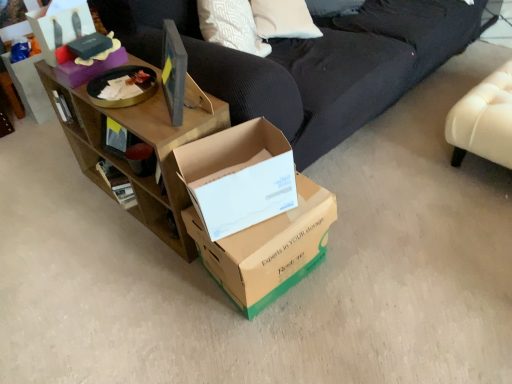
Image resolution: width=512 pixels, height=384 pixels. Describe the element at coordinates (484, 120) in the screenshot. I see `leather ottoman at right` at that location.

What do you see at coordinates (145, 141) in the screenshot? Image resolution: width=512 pixels, height=384 pixels. I see `brown wood shelf at upper left` at bounding box center [145, 141].

What do you see at coordinates (238, 176) in the screenshot? I see `cardboard box at center, the 2th box in the top-to-bottom sequence` at bounding box center [238, 176].

Locate an element on the screen. brown cardboard box at center, positioned as the third box in left-to-right order is located at coordinates pyautogui.click(x=268, y=249).

Does matte black box at upper left, placed as the 1th box when sorted from top to bottom, have a lesser width compared to brown cardboard box at center, the 3th box from the top?

Yes.

Between matte black box at upper left, placed as the 1th box when sorted from top to bottom, and brown cardboard box at center, arranged as the 1th box when viewed from the right, which one has smaller size?

Smaller between the two is matte black box at upper left, placed as the 1th box when sorted from top to bottom.

This screenshot has height=384, width=512. Find the location of `the 2nd box directly above the brown cardboard box at center, arranged as the 1th box when viewed from the right (from a real-world perspective)`. the 2nd box directly above the brown cardboard box at center, arranged as the 1th box when viewed from the right (from a real-world perspective) is located at coordinates (88, 69).

From the image's perspective, is leather ottoman at right located above or below cardboard box at center, the 2th box in the top-to-bottom sequence?

From the image's perspective, leather ottoman at right appears above cardboard box at center, the 2th box in the top-to-bottom sequence.

Which object is further away from the camera, leather ottoman at right or cardboard box at center, which is counted as the 2th box, starting from the left?

leather ottoman at right is further away from the camera.

Locate an element on the screen. furniture located underneath the cardboard box at center, the 2th box in the top-to-bottom sequence (from a real-world perspective) is located at coordinates (x=484, y=120).

Considering the sizes of objects leather ottoman at right and cardboard box at center, the second box in the bottom-to-top sequence, in the image provided, who is shorter, leather ottoman at right or cardboard box at center, the second box in the bottom-to-top sequence,?

cardboard box at center, the second box in the bottom-to-top sequence.

Relative to cardboard box at center, which is counted as the 2th box, starting from the left, is brown cardboard box at center, the 3th box from the top, in front or behind?

Clearly, brown cardboard box at center, the 3th box from the top, is behind cardboard box at center, which is counted as the 2th box, starting from the left.

Who is taller, brown cardboard box at center, arranged as the 1th box when viewed from the right, or cardboard box at center, the 2th box in the top-to-bottom sequence?

Standing taller between the two is brown cardboard box at center, arranged as the 1th box when viewed from the right.

Is brown cardboard box at center, which appears as the 1th box when ordered from the bottom, facing towards cardboard box at center, which is counted as the 2th box, starting from the left?

No, brown cardboard box at center, which appears as the 1th box when ordered from the bottom, does not turn towards cardboard box at center, which is counted as the 2th box, starting from the left.

From the picture: From the image's perspective, does brown cardboard box at center, positioned as the third box in left-to-right order, appear lower than cardboard box at center, which is counted as the 2th box, starting from the left?

Yes, from the image's perspective, brown cardboard box at center, positioned as the third box in left-to-right order, is below cardboard box at center, which is counted as the 2th box, starting from the left.

From the image's perspective, is cardboard box at center, which ranks as the 2th box in right-to-left order, located above or below brown wood shelf at upper left?

cardboard box at center, which ranks as the 2th box in right-to-left order, is situated lower than brown wood shelf at upper left in the image.

Is cardboard box at center, which ranks as the 2th box in right-to-left order, at the right side of brown wood shelf at upper left?

Yes.

Is cardboard box at center, the second box in the bottom-to-top sequence, located outside brown wood shelf at upper left?

cardboard box at center, the second box in the bottom-to-top sequence, lies outside brown wood shelf at upper left's area.

Is point (223, 166) positioned before point (85, 171)?

Yes, point (223, 166) is in front of point (85, 171).

Is brown wood shelf at upper left shorter than cardboard box at center, which is counted as the 2th box, starting from the left?

No.

Which object is thinner, brown wood shelf at upper left or cardboard box at center, which is counted as the 2th box, starting from the left?

Thinner between the two is cardboard box at center, which is counted as the 2th box, starting from the left.

Is brown wood shelf at upper left oriented away from cardboard box at center, which is counted as the 2th box, starting from the left?

No, brown wood shelf at upper left is not facing away from cardboard box at center, which is counted as the 2th box, starting from the left.

Does brown wood shelf at upper left have a smaller size compared to cardboard box at center, which ranks as the 2th box in right-to-left order?

Incorrect, brown wood shelf at upper left is not smaller in size than cardboard box at center, which ranks as the 2th box in right-to-left order.

How many degrees apart are the facing directions of cardboard box at center, which ranks as the 2th box in right-to-left order, and brown cardboard box at center, the 3th box from the top?

14.3 degrees.

Based on the photo, which of these two, cardboard box at center, which is counted as the 2th box, starting from the left, or brown cardboard box at center, the 3th box from the top, is bigger?

With larger size is brown cardboard box at center, the 3th box from the top.

Who is taller, cardboard box at center, which ranks as the 2th box in right-to-left order, or brown cardboard box at center, which appears as the 1th box when ordered from the bottom?

brown cardboard box at center, which appears as the 1th box when ordered from the bottom.

In the image, is cardboard box at center, the 2th box in the top-to-bottom sequence, positioned in front of or behind leather ottoman at right?

cardboard box at center, the 2th box in the top-to-bottom sequence, is positioned closer to the viewer than leather ottoman at right.

From the image's perspective, which one is positioned higher, cardboard box at center, which ranks as the 2th box in right-to-left order, or leather ottoman at right?

leather ottoman at right appears higher in the image.

Is point (211, 153) farther from viewer compared to point (452, 125)?

No, (211, 153) is in front of (452, 125).

From the image's perspective, count 2nd boxs downward from the matte black box at upper left, acting as the 3th box starting from the right, and point to it. Please provide its 2D coordinates.

[(268, 249)]

In the image, there is a cardboard box at center, which ranks as the 2th box in right-to-left order. What are the coordinates of `furniture above it (from the image's perspective)` in the screenshot? It's located at (484, 120).

When comparing their distances from brown cardboard box at center, positioned as the third box in left-to-right order, does leather ottoman at right or cardboard box at center, the second box in the bottom-to-top sequence, seem further?

leather ottoman at right is further to brown cardboard box at center, positioned as the third box in left-to-right order.

Estimate the real-world distances between objects in this image. Which object is closer to cardboard box at center, the second box in the bottom-to-top sequence, matte black box at upper left, placed as the 1th box when sorted from top to bottom, or brown cardboard box at center, arranged as the 1th box when viewed from the right?

brown cardboard box at center, arranged as the 1th box when viewed from the right.

When comparing their distances from matte black box at upper left, which is counted as the first box, starting from the left, does brown cardboard box at center, which appears as the 1th box when ordered from the bottom, or leather ottoman at right seem further?

leather ottoman at right is further to matte black box at upper left, which is counted as the first box, starting from the left.

From the image, which object appears to be farther from matte black box at upper left, placed as the 1th box when sorted from top to bottom, cardboard box at center, the 2th box in the top-to-bottom sequence, or brown cardboard box at center, which appears as the 1th box when ordered from the bottom?

Based on the image, brown cardboard box at center, which appears as the 1th box when ordered from the bottom, appears to be further to matte black box at upper left, placed as the 1th box when sorted from top to bottom.

When comparing their distances from brown cardboard box at center, arranged as the 1th box when viewed from the right, does matte black box at upper left, which is the third box from bottom to top, or cardboard box at center, which is counted as the 2th box, starting from the left, seem closer?

cardboard box at center, which is counted as the 2th box, starting from the left, is closer to brown cardboard box at center, arranged as the 1th box when viewed from the right.

Considering their positions, is cardboard box at center, which ranks as the 2th box in right-to-left order, positioned closer to leather ottoman at right than brown wood shelf at upper left?

The object closer to leather ottoman at right is cardboard box at center, which ranks as the 2th box in right-to-left order.

Considering their positions, is leather ottoman at right positioned further to brown wood shelf at upper left than matte black box at upper left, placed as the 1th box when sorted from top to bottom?

The object further to brown wood shelf at upper left is leather ottoman at right.

Which object lies further to the anchor point leather ottoman at right, matte black box at upper left, acting as the 3th box starting from the right, or brown wood shelf at upper left?

matte black box at upper left, acting as the 3th box starting from the right.

Locate an element on the screen. box between matte black box at upper left, acting as the 3th box starting from the right, and brown cardboard box at center, the 3th box from the top, from left to right is located at coordinates (238, 176).

At what (x,y) coordinates should I click in order to perform the action: click on box between brown wood shelf at upper left and brown cardboard box at center, positioned as the third box in left-to-right order, from left to right. Please return your answer as a coordinate pair (x, y). Image resolution: width=512 pixels, height=384 pixels. Looking at the image, I should click on (238, 176).

Where is `box between cardboard box at center, the second box in the bottom-to-top sequence, and leather ottoman at right`? This screenshot has width=512, height=384. box between cardboard box at center, the second box in the bottom-to-top sequence, and leather ottoman at right is located at coordinates (268, 249).

The height and width of the screenshot is (384, 512). I want to click on shelf between matte black box at upper left, which is the third box from bottom to top, and brown cardboard box at center, positioned as the third box in left-to-right order, from left to right, so click(x=145, y=141).